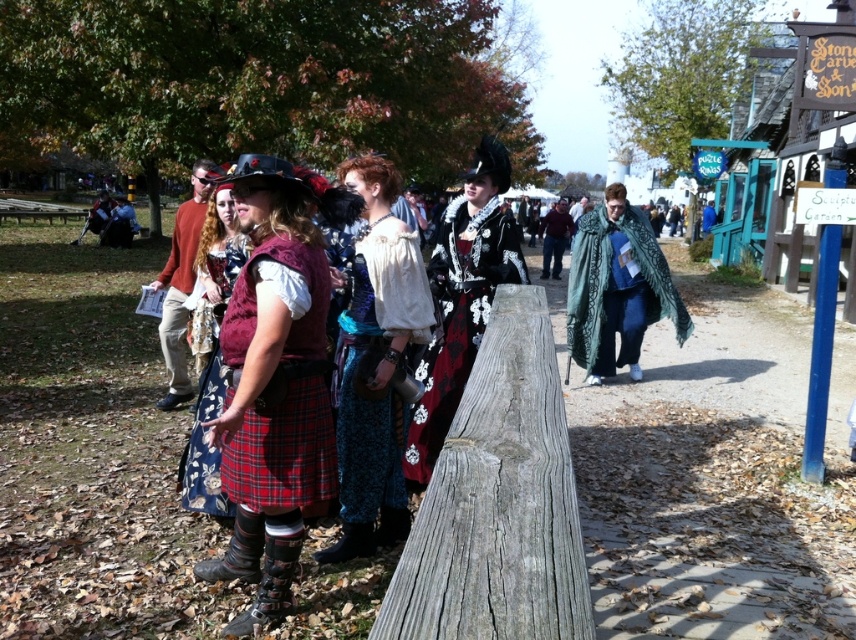
Question: Does velvet maroon vest at center appear on the right side of dark green cloak at right?

Choices:
 (A) yes
 (B) no

Answer: (B)

Question: Which point is farther from the camera taking this photo?

Choices:
 (A) (170, 346)
 (B) (421, 285)
 (C) (544, 262)

Answer: (C)

Question: Estimate the real-world distances between objects in this image. Which object is closer to the velvet black coat at center?

Choices:
 (A) green textured cloak at center
 (B) floral fabric skirt at center

Answer: (B)

Question: Is velvet blue dress at center wider than velvet black coat at center?

Choices:
 (A) no
 (B) yes

Answer: (A)

Question: Based on their relative distances, which object is farther from the velvet maroon vest at center?

Choices:
 (A) green textured cloak at center
 (B) matte red sweater at center
 (C) blue fabric coat at center
 (D) velvet blue dress at center

Answer: (C)

Question: Is green textured cloak at center to the left of matte red sweater at center from the viewer's perspective?

Choices:
 (A) yes
 (B) no

Answer: (B)